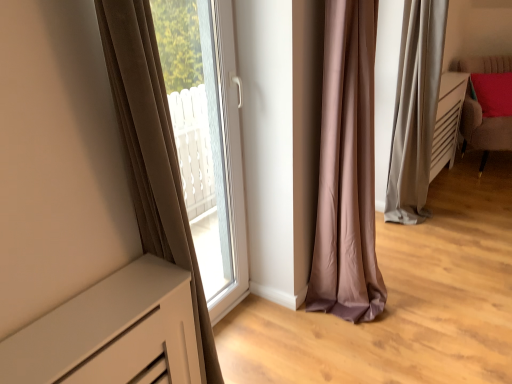
Describe the element at coordinates (483, 130) in the screenshot. I see `velvet red cushion at right` at that location.

Find the location of a particular element. Image resolution: width=512 pixels, height=384 pixels. velvet red cushion at right is located at coordinates (483, 130).

Locate an element on the screen. The width and height of the screenshot is (512, 384). velvet red cushion at right is located at coordinates (483, 130).